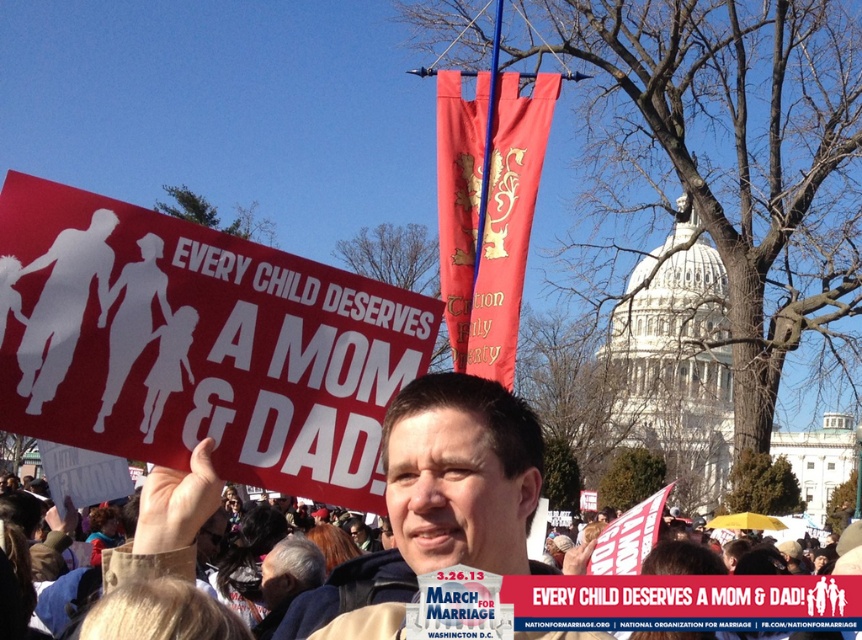
Which is below, matte red sign at left or matte black sign at center?

matte black sign at center is lower down.

Consider the image. Who is more forward, [176,387] or [290,620]?

Point [176,387]

What do you see at coordinates (197, 344) in the screenshot?
I see `matte red sign at left` at bounding box center [197, 344].

Where is `matte red sign at left`? matte red sign at left is located at coordinates (197, 344).